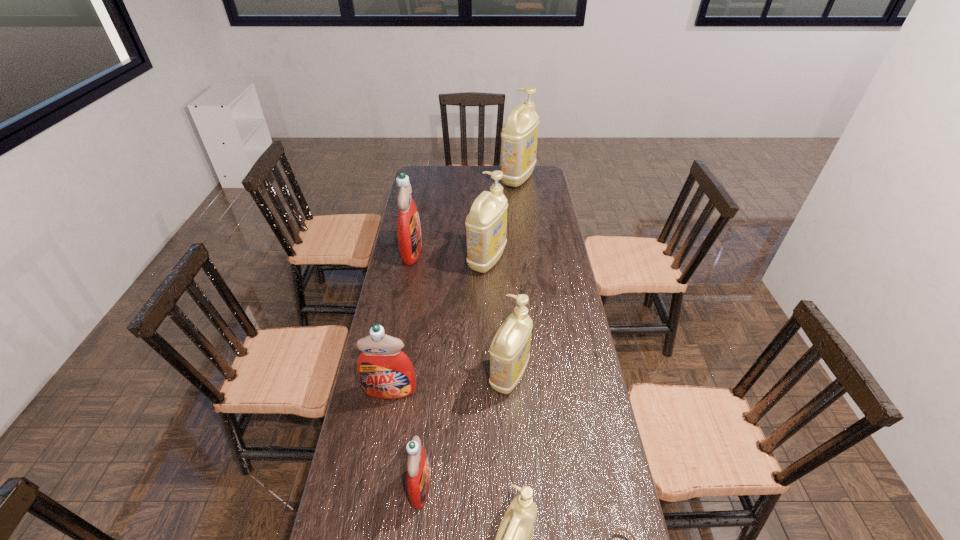
I want to click on vacant space located 0.100m on the front surface of the farthest red detergent, so click(x=445, y=251).

You are a GUI agent. You are given a task and a screenshot of the screen. Output one action in this format:
    pyautogui.click(x=<x>, y=<y>)
    Task: Click on the vacant space located on the left of the third biggest beige detergent
    
    Given the screenshot: What is the action you would take?
    click(399, 376)

Locate an element on the screen. free space located 0.250m on the front surface of the second biggest red detergent is located at coordinates (374, 483).

Identify the location of vacant space located 0.390m on the front surface of the rightmost red detergent. This screenshot has width=960, height=540. (578, 487).

Locate an element on the screen. object situated at the far edge is located at coordinates (519, 135).

The image size is (960, 540). What are the coordinates of `object that is at the right edge` in the screenshot? It's located at (519, 135).

I want to click on object situated at the far right corner, so click(519, 135).

Identify the location of free space at the far edge of the desktop. The width and height of the screenshot is (960, 540). (490, 170).

Locate an element on the screen. The width and height of the screenshot is (960, 540). free space at the left edge of the desktop is located at coordinates (417, 286).

The width and height of the screenshot is (960, 540). I want to click on vacant space at the right edge, so click(x=526, y=205).